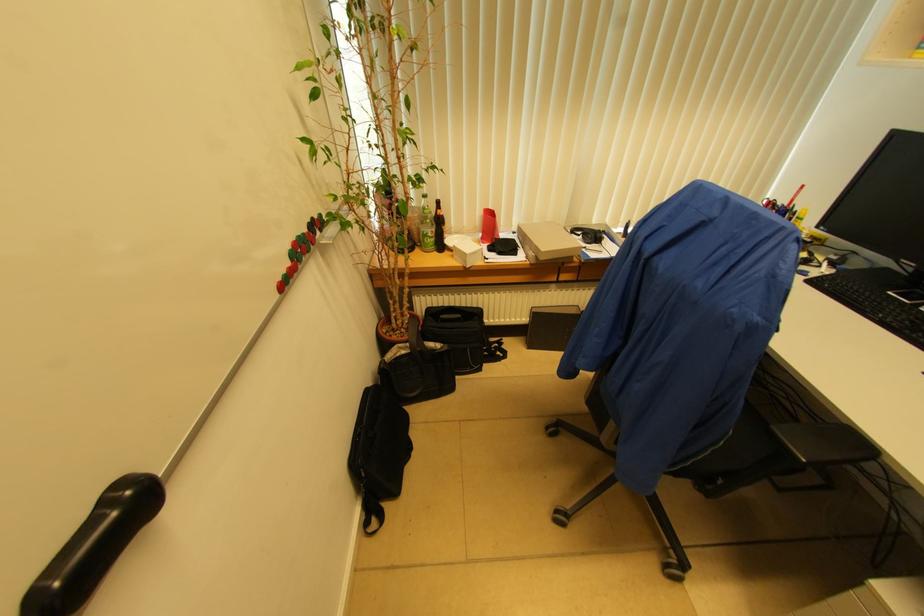
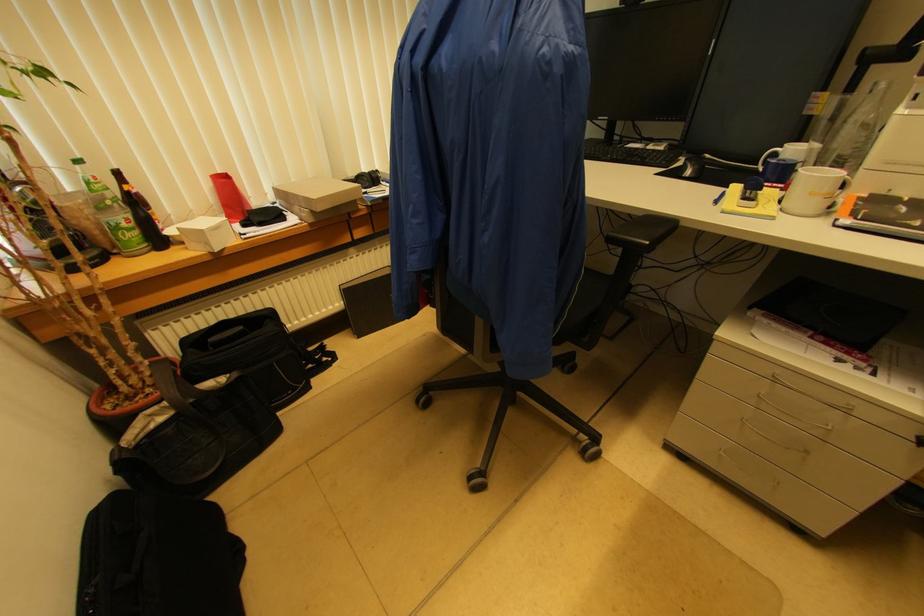
In the second image, find the point that corresponds to [543,252] in the first image.

(315, 200)